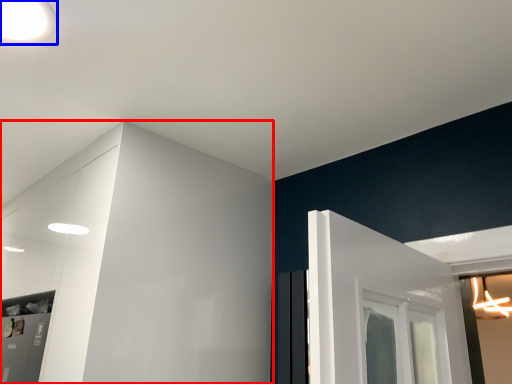
Question: Which point is closer to the camera, dresser (highlighted by a red box) or light (highlighted by a blue box)?

Choices:
 (A) dresser
 (B) light

Answer: (B)